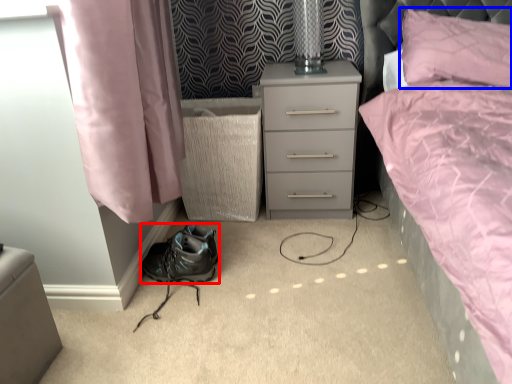
Question: Among these objects, which one is nearest to the camera, shoe (highlighted by a red box) or pillow (highlighted by a blue box)?

Choices:
 (A) shoe
 (B) pillow

Answer: (B)